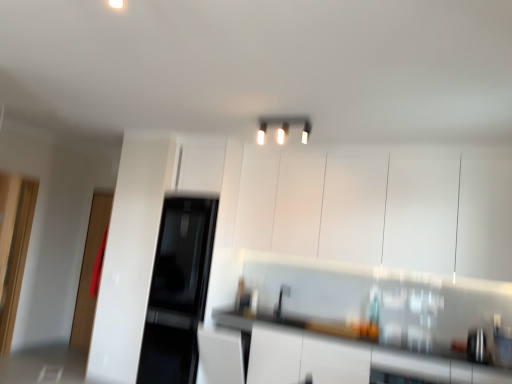
Question: Does white glossy countertop at lower right come in front of sleek stainless steel kettle at lower right, the 2th appliance when ordered from top to bottom?

Choices:
 (A) yes
 (B) no

Answer: (A)

Question: Does white glossy countertop at lower right have a greater height compared to sleek stainless steel kettle at lower right, the second appliance in the left-to-right sequence?

Choices:
 (A) yes
 (B) no

Answer: (A)

Question: Does white glossy countertop at lower right have a lesser width compared to sleek stainless steel kettle at lower right, which is the 1th appliance from front to back?

Choices:
 (A) no
 (B) yes

Answer: (A)

Question: Is white glossy countertop at lower right positioned far away from sleek stainless steel kettle at lower right, arranged as the 1th appliance when viewed from the right?

Choices:
 (A) yes
 (B) no

Answer: (A)

Question: Could you tell me if white glossy countertop at lower right is facing sleek stainless steel kettle at lower right, the second appliance in the left-to-right sequence?

Choices:
 (A) no
 (B) yes

Answer: (A)

Question: From a real-world perspective, relative to black glass refrigerator at center, the 2th appliance in the bottom-to-top sequence, is white glossy light fixture at upper center vertically above or below?

Choices:
 (A) above
 (B) below

Answer: (A)

Question: Based on their sizes in the image, would you say white glossy light fixture at upper center is bigger or smaller than black glass refrigerator at center, the 2th appliance positioned from the front?

Choices:
 (A) small
 (B) big

Answer: (A)

Question: Is white glossy light fixture at upper center inside or outside of black glass refrigerator at center, the 1th appliance positioned from the left?

Choices:
 (A) outside
 (B) inside

Answer: (A)

Question: Considering the positions of white glossy light fixture at upper center and black glass refrigerator at center, the 2th appliance positioned from the front, in the image, is white glossy light fixture at upper center wider or thinner than black glass refrigerator at center, the 2th appliance positioned from the front,?

Choices:
 (A) wide
 (B) thin

Answer: (B)

Question: Does point (27, 203) appear closer or farther from the camera than point (306, 127)?

Choices:
 (A) closer
 (B) farther

Answer: (B)

Question: Looking at the image, does transparent glass door at left, the second glass door viewed from the back, seem bigger or smaller compared to white glossy light fixture at upper center?

Choices:
 (A) big
 (B) small

Answer: (A)

Question: Is transparent glass door at left, the second glass door viewed from the back, in front of or behind white glossy light fixture at upper center in the image?

Choices:
 (A) behind
 (B) front

Answer: (A)

Question: Would you say transparent glass door at left, which is counted as the 1th glass door, starting from the front, is inside or outside white glossy light fixture at upper center?

Choices:
 (A) inside
 (B) outside

Answer: (B)

Question: Would you say transparent glass door at left, the second glass door viewed from the back, is inside or outside white glossy countertop at lower right?

Choices:
 (A) inside
 (B) outside

Answer: (B)

Question: From a real-world perspective, is transparent glass door at left, the second glass door viewed from the back, above or below white glossy countertop at lower right?

Choices:
 (A) above
 (B) below

Answer: (A)